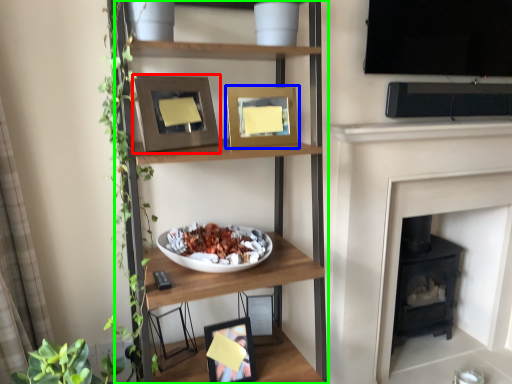
Question: Considering the real-world distances, which object is closest to picture frame (highlighted by a red box)? picture frame (highlighted by a blue box) or shelf (highlighted by a green box).

Choices:
 (A) picture frame
 (B) shelf

Answer: (B)